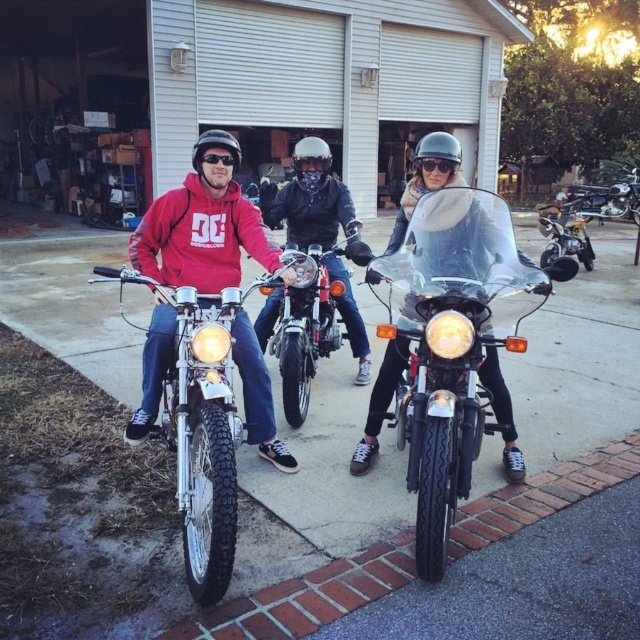
You are a photographer trying to capture a clear photo of the matte black helmet at center. However, the matte black motorcycle at left is blocking your view. Can you move around to the right side of the motorcycle to get an unobstructed shot?

The matte black motorcycle at left is in front of the matte black helmet at center, so moving to the right side of the motorcycle would allow you to see the matte black helmet at center without obstruction.

You are a delivery person who needs to place a package between the matte black motorcycle at left and the matte black helmet at center. The package requires 5 feet of space to be placed safely. Based on the scene, can you fit the package between them?

The matte black motorcycle at left and matte black helmet at center are 4.85 feet apart from each other. Since the required space is 5 feet, the package cannot be placed safely between them as there is insufficient space.

You are standing at the origin point of the coordinate system in the image. You need to locate the matte red hoodie at center. Which direction should you move to reach it?

The matte red hoodie at center is located at coordinate point 0.355 on the x axis and 0.317 on the y axis. Since you are at the origin, you should move right along the x axis to 0.355 and up along the y axis to 0.317 to reach it.